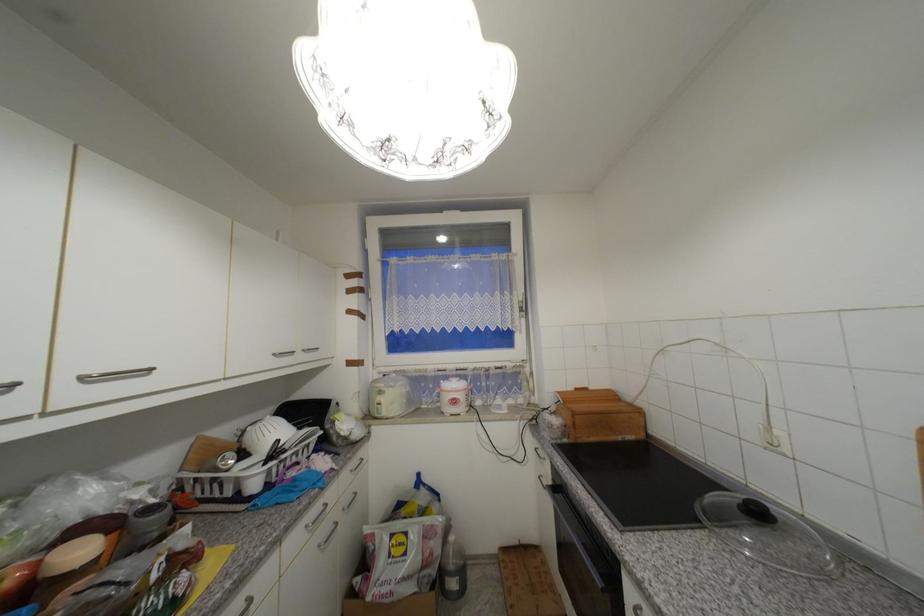
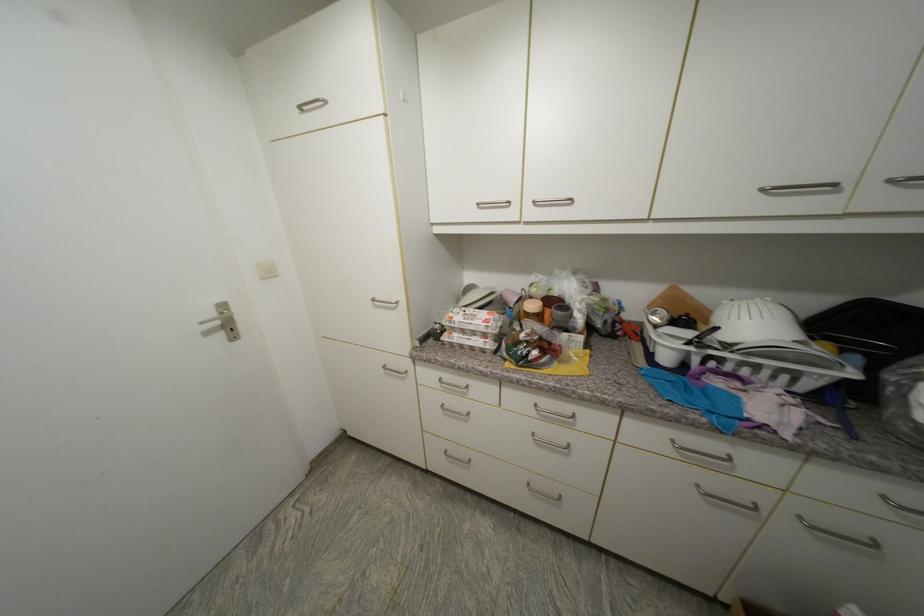
Where in the second image is the point corresponding to (x=312, y=528) from the first image?

(678, 443)